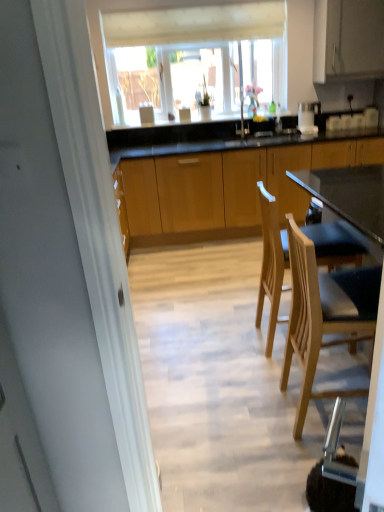
This screenshot has width=384, height=512. Describe the element at coordinates (271, 263) in the screenshot. I see `light wood chair at right, which appears as the first chair when viewed from the back` at that location.

You are a GUI agent. You are given a task and a screenshot of the screen. Output one action in this format:
    pyautogui.click(x=<x>, y=<y>)
    Task: Click on the light wood chair at lower right, positioned as the first chair in front-to-back order
    This screenshot has width=384, height=512.
    Given the screenshot: What is the action you would take?
    pyautogui.click(x=324, y=315)

The width and height of the screenshot is (384, 512). In order to click on cabinetry above the wooden cabinets at center, the 1th cabinetry ordered from the bottom (from a real-world perspective) in this screenshot , I will do `click(348, 39)`.

Is wooden cabinets at center, which is counted as the 2th cabinetry, starting from the top, behind white matte cabinet at upper right, placed as the first cabinetry when sorted from top to bottom?

Yes, the depth of wooden cabinets at center, which is counted as the 2th cabinetry, starting from the top, is greater than that of white matte cabinet at upper right, placed as the first cabinetry when sorted from top to bottom.

Considering the relative sizes of wooden cabinets at center, which is counted as the 2th cabinetry, starting from the top, and white matte cabinet at upper right, marked as the second cabinetry in a bottom-to-top arrangement, in the image provided, is wooden cabinets at center, which is counted as the 2th cabinetry, starting from the top, bigger than white matte cabinet at upper right, marked as the second cabinetry in a bottom-to-top arrangement,?

Indeed, wooden cabinets at center, which is counted as the 2th cabinetry, starting from the top, has a larger size compared to white matte cabinet at upper right, marked as the second cabinetry in a bottom-to-top arrangement.

From a real-world perspective, is white matte cabinet at upper right, marked as the second cabinetry in a bottom-to-top arrangement, physically located above or below light wood chair at right, arranged as the second chair when viewed from the front?

In terms of real-world spatial position, white matte cabinet at upper right, marked as the second cabinetry in a bottom-to-top arrangement, is above light wood chair at right, arranged as the second chair when viewed from the front.

Can you confirm if white matte cabinet at upper right, placed as the first cabinetry when sorted from top to bottom, is positioned to the left of light wood chair at right, which appears as the first chair when viewed from the back?

No, white matte cabinet at upper right, placed as the first cabinetry when sorted from top to bottom, is not to the left of light wood chair at right, which appears as the first chair when viewed from the back.

Is white matte cabinet at upper right, placed as the first cabinetry when sorted from top to bottom, shorter than light wood chair at right, arranged as the second chair when viewed from the front?

Indeed, white matte cabinet at upper right, placed as the first cabinetry when sorted from top to bottom, has a lesser height compared to light wood chair at right, arranged as the second chair when viewed from the front.

Considering the relative sizes of white matte cabinet at upper right, placed as the first cabinetry when sorted from top to bottom, and light wood chair at right, arranged as the second chair when viewed from the front, in the image provided, is white matte cabinet at upper right, placed as the first cabinetry when sorted from top to bottom, bigger than light wood chair at right, arranged as the second chair when viewed from the front,?

Correct, white matte cabinet at upper right, placed as the first cabinetry when sorted from top to bottom, is larger in size than light wood chair at right, arranged as the second chair when viewed from the front.

From a real-world perspective, is light wood chair at lower right, positioned as the first chair in front-to-back order, above or below transparent glass window at upper center?

light wood chair at lower right, positioned as the first chair in front-to-back order, is below transparent glass window at upper center.

Is the position of light wood chair at lower right, positioned as the first chair in front-to-back order, less distant than that of transparent glass window at upper center?

Yes, it is in front of transparent glass window at upper center.

Considering the sizes of light wood chair at lower right, positioned as the first chair in front-to-back order, and transparent glass window at upper center in the image, is light wood chair at lower right, positioned as the first chair in front-to-back order, wider or thinner than transparent glass window at upper center?

In the image, light wood chair at lower right, positioned as the first chair in front-to-back order, appears to be wider than transparent glass window at upper center.

Measure the distance from light wood chair at lower right, positioned as the first chair in front-to-back order, to transparent glass window at upper center.

The distance of light wood chair at lower right, positioned as the first chair in front-to-back order, from transparent glass window at upper center is 7.03 feet.

Considering the sizes of objects wooden cabinets at center, which is counted as the 2th cabinetry, starting from the top, and transparent glass window at upper center in the image provided, who is smaller, wooden cabinets at center, which is counted as the 2th cabinetry, starting from the top, or transparent glass window at upper center?

transparent glass window at upper center is smaller.

Considering the relative sizes of wooden cabinets at center, the 1th cabinetry ordered from the bottom, and transparent glass window at upper center in the image provided, is wooden cabinets at center, the 1th cabinetry ordered from the bottom, shorter than transparent glass window at upper center?

No.

How far apart are wooden cabinets at center, the 1th cabinetry ordered from the bottom, and transparent glass window at upper center?

A distance of 3.60 feet exists between wooden cabinets at center, the 1th cabinetry ordered from the bottom, and transparent glass window at upper center.

From a real-world perspective, is wooden cabinets at center, the 1th cabinetry ordered from the bottom, over transparent glass window at upper center?

No, from a real-world perspective, wooden cabinets at center, the 1th cabinetry ordered from the bottom, is not over transparent glass window at upper center

Where is `cabinetry on the left of white matte cabinet at upper right, placed as the first cabinetry when sorted from top to bottom`? cabinetry on the left of white matte cabinet at upper right, placed as the first cabinetry when sorted from top to bottom is located at coordinates (220, 187).

What's the angular difference between white matte cabinet at upper right, placed as the first cabinetry when sorted from top to bottom, and wooden cabinets at center, which is counted as the 2th cabinetry, starting from the top,'s facing directions?

The angle between the facing direction of white matte cabinet at upper right, placed as the first cabinetry when sorted from top to bottom, and the facing direction of wooden cabinets at center, which is counted as the 2th cabinetry, starting from the top, is 0.26 degrees.

Is point (365, 78) positioned after point (199, 239)?

No, (365, 78) is in front of (199, 239).

Which of these two, white matte cabinet at upper right, marked as the second cabinetry in a bottom-to-top arrangement, or wooden cabinets at center, which is counted as the 2th cabinetry, starting from the top, stands shorter?

white matte cabinet at upper right, marked as the second cabinetry in a bottom-to-top arrangement, is shorter.

In order to click on cabinetry above the transparent glass window at upper center (from a real-world perspective) in this screenshot , I will do `click(348, 39)`.

Between point (331, 23) and point (198, 12), which one is positioned in front?

Positioned in front is point (331, 23).

Is white matte cabinet at upper right, placed as the first cabinetry when sorted from top to bottom, behind transparent glass window at upper center?

No, it is not.

In terms of height, does white matte cabinet at upper right, placed as the first cabinetry when sorted from top to bottom, look taller or shorter compared to transparent glass window at upper center?

In the image, white matte cabinet at upper right, placed as the first cabinetry when sorted from top to bottom, appears to be shorter than transparent glass window at upper center.

Does white matte cabinet at upper right, marked as the second cabinetry in a bottom-to-top arrangement, appear on the left side of light wood chair at lower right, which is the second chair from back to front?

No.

Consider the image. Can you tell me how much white matte cabinet at upper right, marked as the second cabinetry in a bottom-to-top arrangement, and light wood chair at lower right, which is the second chair from back to front, differ in facing direction?

The angle between the facing direction of white matte cabinet at upper right, marked as the second cabinetry in a bottom-to-top arrangement, and the facing direction of light wood chair at lower right, which is the second chair from back to front, is 88.4 degrees.

Who is taller, white matte cabinet at upper right, marked as the second cabinetry in a bottom-to-top arrangement, or light wood chair at lower right, positioned as the first chair in front-to-back order?

light wood chair at lower right, positioned as the first chair in front-to-back order, is taller.

Which is farther, (330,72) or (322,310)?

The point (330,72) is more distant.

I want to click on cabinetry that appears in front of the wooden cabinets at center, which is counted as the 2th cabinetry, starting from the top, so click(x=348, y=39).

Find the location of `chair that is the 2nd one when counting leftward from the white matte cabinet at upper right, placed as the first cabinetry when sorted from top to bottom`. chair that is the 2nd one when counting leftward from the white matte cabinet at upper right, placed as the first cabinetry when sorted from top to bottom is located at coordinates (271, 263).

Based on their spatial positions, is light wood chair at lower right, positioned as the first chair in front-to-back order, or light wood chair at right, which appears as the first chair when viewed from the back, further from wooden cabinets at center, which is counted as the 2th cabinetry, starting from the top?

light wood chair at lower right, positioned as the first chair in front-to-back order, is positioned further to the anchor wooden cabinets at center, which is counted as the 2th cabinetry, starting from the top.

From the image, which object appears to be nearer to light wood chair at right, which appears as the first chair when viewed from the back, wooden cabinets at center, the 1th cabinetry ordered from the bottom, or transparent glass window at upper center?

The object closer to light wood chair at right, which appears as the first chair when viewed from the back, is wooden cabinets at center, the 1th cabinetry ordered from the bottom.

Looking at the image, which one is located further to light wood chair at right, which appears as the first chair when viewed from the back, wooden cabinets at center, the 1th cabinetry ordered from the bottom, or white matte cabinet at upper right, marked as the second cabinetry in a bottom-to-top arrangement?

white matte cabinet at upper right, marked as the second cabinetry in a bottom-to-top arrangement, lies further to light wood chair at right, which appears as the first chair when viewed from the back, than the other object.

Considering their positions, is wooden cabinets at center, the 1th cabinetry ordered from the bottom, positioned closer to white matte cabinet at upper right, marked as the second cabinetry in a bottom-to-top arrangement, than transparent glass window at upper center?

transparent glass window at upper center.

Based on their spatial positions, is transparent glass window at upper center or light wood chair at right, arranged as the second chair when viewed from the front, further from wooden cabinets at center, which is counted as the 2th cabinetry, starting from the top?

Among the two, light wood chair at right, arranged as the second chair when viewed from the front, is located further to wooden cabinets at center, which is counted as the 2th cabinetry, starting from the top.

Looking at the image, which one is located further to light wood chair at lower right, which is the second chair from back to front, light wood chair at right, arranged as the second chair when viewed from the front, or white matte cabinet at upper right, placed as the first cabinetry when sorted from top to bottom?

Among the two, white matte cabinet at upper right, placed as the first cabinetry when sorted from top to bottom, is located further to light wood chair at lower right, which is the second chair from back to front.

Estimate the real-world distances between objects in this image. Which object is closer to light wood chair at lower right, which is the second chair from back to front, light wood chair at right, which appears as the first chair when viewed from the back, or wooden cabinets at center, the 1th cabinetry ordered from the bottom?

light wood chair at right, which appears as the first chair when viewed from the back, is positioned closer to the anchor light wood chair at lower right, which is the second chair from back to front.

Considering their positions, is light wood chair at lower right, positioned as the first chair in front-to-back order, positioned further to light wood chair at right, which appears as the first chair when viewed from the back, than white matte cabinet at upper right, marked as the second cabinetry in a bottom-to-top arrangement?

white matte cabinet at upper right, marked as the second cabinetry in a bottom-to-top arrangement, is positioned further to the anchor light wood chair at right, which appears as the first chair when viewed from the back.

The image size is (384, 512). What are the coordinates of `cabinetry between white matte cabinet at upper right, marked as the second cabinetry in a bottom-to-top arrangement, and light wood chair at right, which appears as the first chair when viewed from the back, from top to bottom` in the screenshot? It's located at (220, 187).

The width and height of the screenshot is (384, 512). I want to click on cabinetry between transparent glass window at upper center and white matte cabinet at upper right, placed as the first cabinetry when sorted from top to bottom, from left to right, so click(220, 187).

Locate an element on the screen. chair between light wood chair at lower right, which is the second chair from back to front, and transparent glass window at upper center in the front-back direction is located at coordinates (271, 263).

This screenshot has height=512, width=384. Find the location of `cabinetry located between light wood chair at lower right, which is the second chair from back to front, and wooden cabinets at center, the 1th cabinetry ordered from the bottom, in the depth direction`. cabinetry located between light wood chair at lower right, which is the second chair from back to front, and wooden cabinets at center, the 1th cabinetry ordered from the bottom, in the depth direction is located at coordinates (348, 39).